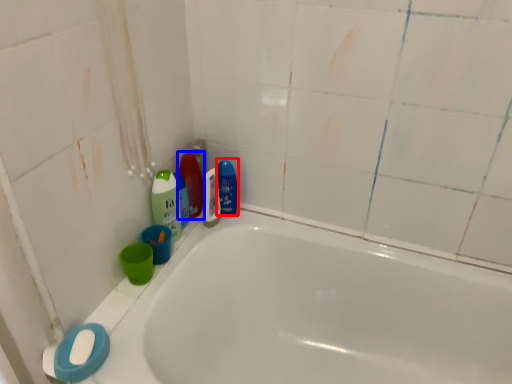
Question: Which object is further to the camera taking this photo, cleaning product (highlighted by a red box) or cleaning product (highlighted by a blue box)?

Choices:
 (A) cleaning product
 (B) cleaning product

Answer: (A)